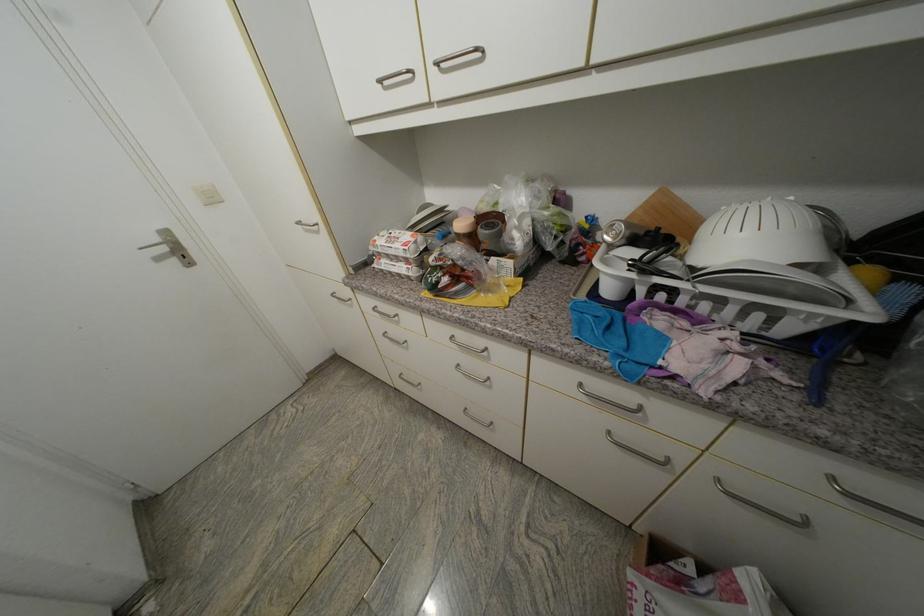
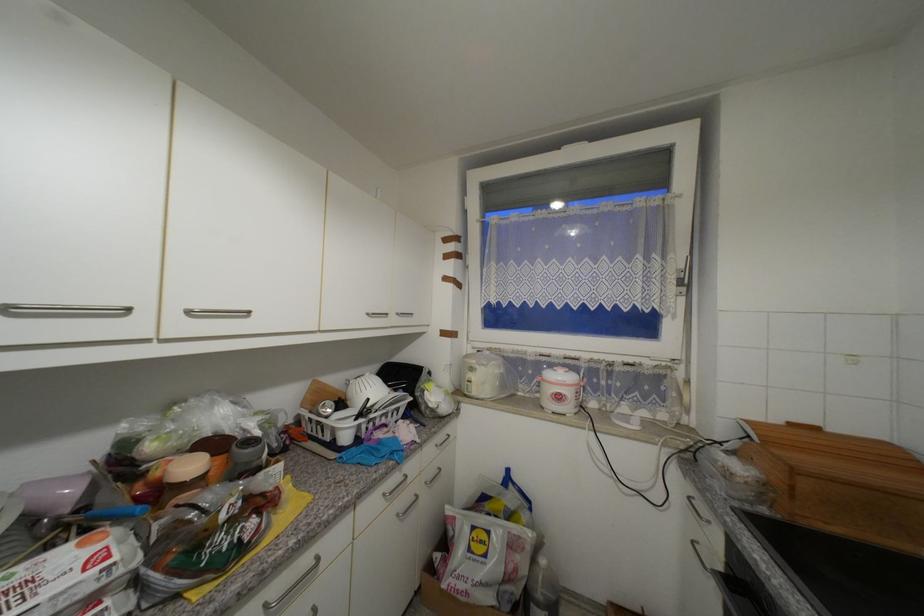
Question: The camera is either moving clockwise (left) or counter-clockwise (right) around the object. The first image is from the beginning of the video and the second image is from the end. Is the camera moving left or right when shooting the video?

Choices:
 (A) Left
 (B) Right

Answer: (A)